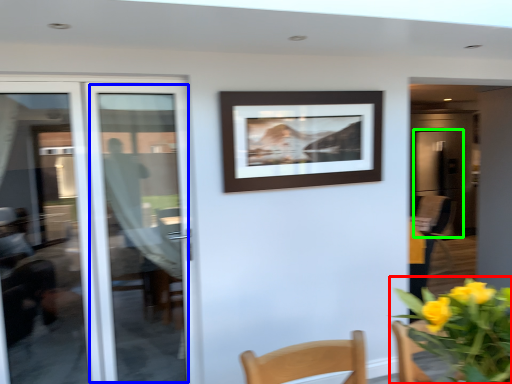
Question: Based on their relative distances, which object is farther from floral arrangement (highlighted by a red box)? Choose from door (highlighted by a blue box) and screen door (highlighted by a green box).

Choices:
 (A) door
 (B) screen door

Answer: (B)